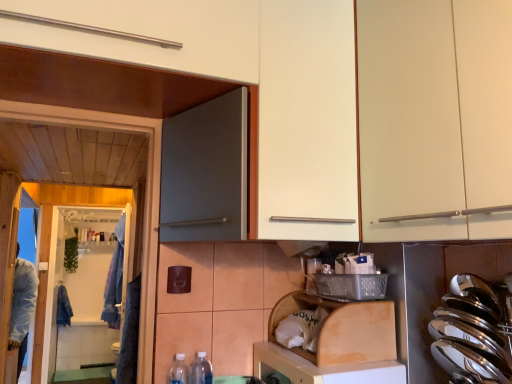
Question: Does white matte cabinet at upper right have a larger size compared to polished stainless steel spoons at right?

Choices:
 (A) yes
 (B) no

Answer: (A)

Question: Considering the relative sizes of white matte cabinet at upper right and polished stainless steel spoons at right in the image provided, is white matte cabinet at upper right wider than polished stainless steel spoons at right?

Choices:
 (A) yes
 (B) no

Answer: (A)

Question: Is white matte cabinet at upper right behind polished stainless steel spoons at right?

Choices:
 (A) no
 (B) yes

Answer: (A)

Question: Considering the relative sizes of white matte cabinet at upper right and polished stainless steel spoons at right in the image provided, is white matte cabinet at upper right thinner than polished stainless steel spoons at right?

Choices:
 (A) no
 (B) yes

Answer: (A)

Question: Can you confirm if white matte cabinet at upper right is positioned to the right of polished stainless steel spoons at right?

Choices:
 (A) no
 (B) yes

Answer: (A)

Question: Can you confirm if white matte cabinet at upper right is taller than polished stainless steel spoons at right?

Choices:
 (A) yes
 (B) no

Answer: (A)

Question: Would you say white glossy screen door at lower left contains denim jacket at left, which appears as the second laundry when viewed from the right?

Choices:
 (A) no
 (B) yes

Answer: (A)

Question: From the image's perspective, is white glossy screen door at lower left below denim jacket at left, the 2th laundry when ordered from front to back?

Choices:
 (A) no
 (B) yes

Answer: (A)

Question: Does white glossy screen door at lower left have a greater height compared to denim jacket at left, the 1th laundry positioned from the left?

Choices:
 (A) no
 (B) yes

Answer: (B)

Question: Is white glossy screen door at lower left next to denim jacket at left, the 2th laundry when ordered from front to back, and touching it?

Choices:
 (A) no
 (B) yes

Answer: (A)

Question: Can you confirm if white glossy screen door at lower left is thinner than denim jacket at left, the 1th laundry positioned from the left?

Choices:
 (A) yes
 (B) no

Answer: (A)

Question: Is white glossy screen door at lower left positioned before denim jacket at left, acting as the first laundry starting from the back?

Choices:
 (A) no
 (B) yes

Answer: (B)

Question: Is polished stainless steel spoons at right closer to camera compared to denim jacket at left, which appears as the second laundry when viewed from the right?

Choices:
 (A) no
 (B) yes

Answer: (B)